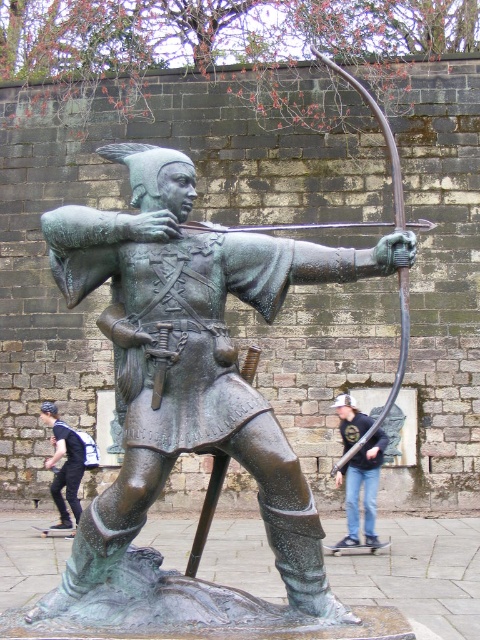
Question: Can you confirm if jeans at lower right is bigger than dark blue jeans at lower left?

Choices:
 (A) no
 (B) yes

Answer: (B)

Question: Which point is farther to the camera?

Choices:
 (A) (340, 408)
 (B) (50, 467)

Answer: (B)

Question: Which is farther from the green patina bronze archer at center?

Choices:
 (A) jeans at lower right
 (B) dark blue jeans at lower left

Answer: (B)

Question: Can you confirm if green patina bronze archer at center is smaller than dark blue jeans at lower left?

Choices:
 (A) no
 (B) yes

Answer: (A)

Question: Is jeans at lower right bigger than dark blue jeans at lower left?

Choices:
 (A) no
 (B) yes

Answer: (B)

Question: Among these objects, which one is farthest from the camera?

Choices:
 (A) green patina bronze archer at center
 (B) jeans at lower right
 (C) dark blue jeans at lower left

Answer: (C)